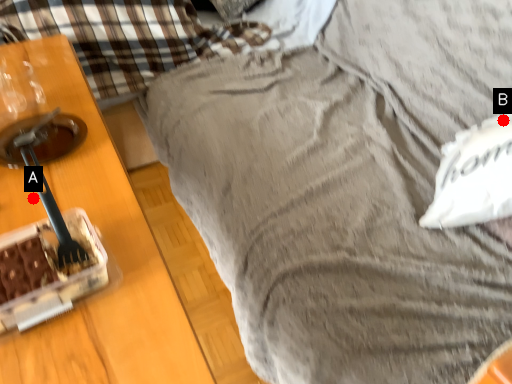
Question: Two points are circled on the image, labeled by A and B beside each circle. Which point appears closest to the camera in this image?

Choices:
 (A) A is closer
 (B) B is closer

Answer: (A)